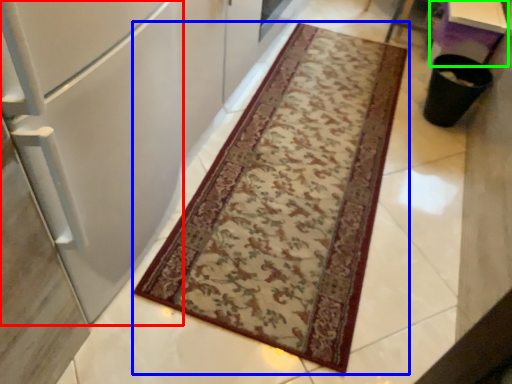
Question: Which object is positioned farthest from fridge (highlighted by a red box)? Select from mat (highlighted by a blue box) and table (highlighted by a green box).

Choices:
 (A) mat
 (B) table

Answer: (B)